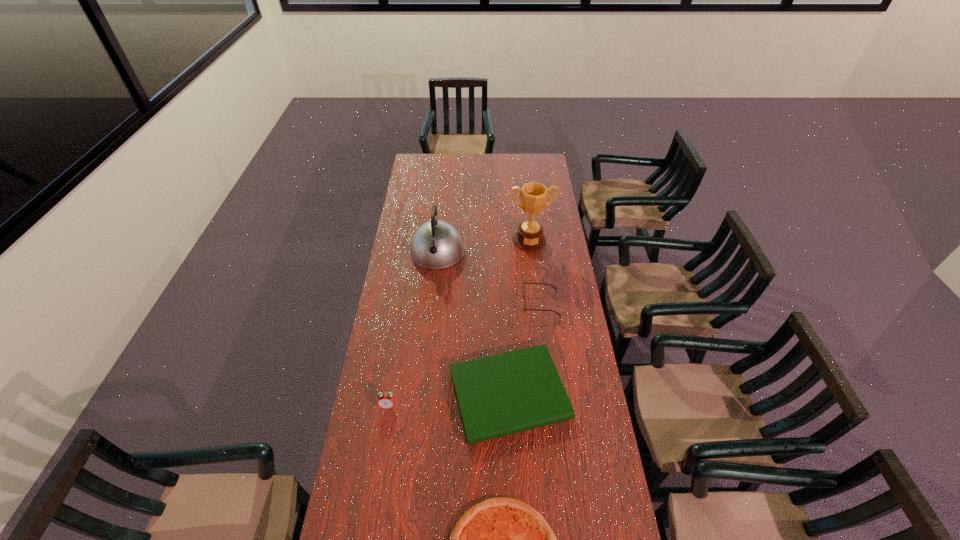
Where is `vacant space situated on the front-facing side of the fourth tallest object`? vacant space situated on the front-facing side of the fourth tallest object is located at coordinates (496, 302).

The width and height of the screenshot is (960, 540). In order to click on vacant space located on the front-facing side of the fourth tallest object in this screenshot , I will do `click(486, 302)`.

The height and width of the screenshot is (540, 960). Identify the location of free space located on the left of the paperback book. (388, 395).

Where is `kettle located at the left edge`? The height and width of the screenshot is (540, 960). kettle located at the left edge is located at coordinates (436, 244).

This screenshot has width=960, height=540. I want to click on alarm clock present at the left edge, so pyautogui.click(x=386, y=400).

At what (x,y) coordinates should I click in order to perform the action: click on award that is positioned at the right edge. Please return your answer as a coordinate pair (x, y). Looking at the image, I should click on (529, 237).

This screenshot has width=960, height=540. I want to click on spectacles that is at the right edge, so click(525, 309).

You are a GUI agent. You are given a task and a screenshot of the screen. Output one action in this format:
    pyautogui.click(x=<x>, y=<y>)
    Task: Click on the paperback book at the right edge
    The image size is (960, 540).
    Given the screenshot: What is the action you would take?
    pyautogui.click(x=497, y=395)

Identify the location of vacant area at the far edge of the desktop. (x=480, y=163).

Where is `free space at the left edge of the desktop`? The width and height of the screenshot is (960, 540). free space at the left edge of the desktop is located at coordinates (x=430, y=221).